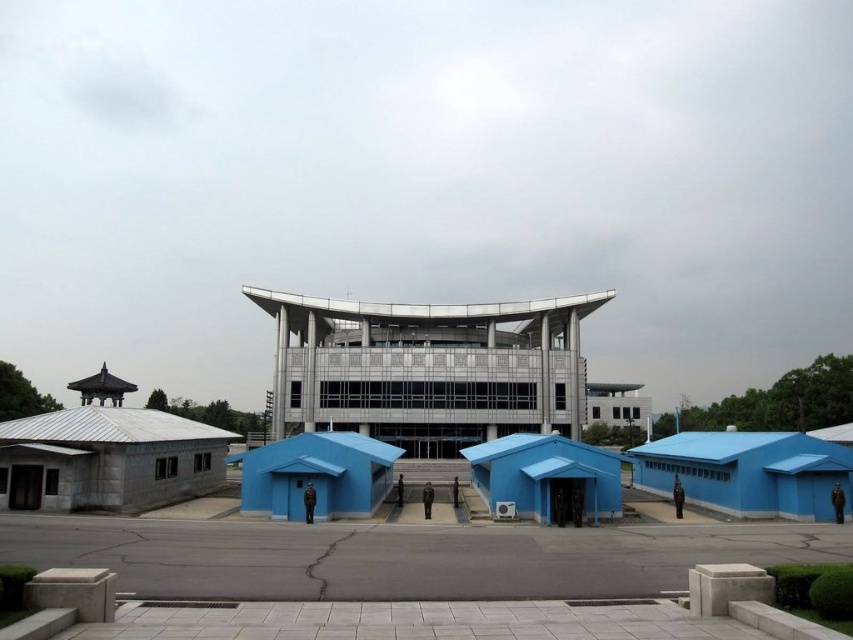
Question: Which object is the closest to the matte blue shelter at center?

Choices:
 (A) blue matte shelter at center
 (B) blue matte shelter at lower right

Answer: (A)

Question: Considering the relative positions of blue matte shelter at center and matte blue shelter at center in the image provided, where is blue matte shelter at center located with respect to matte blue shelter at center?

Choices:
 (A) above
 (B) below

Answer: (A)

Question: Which point is farther from the camera taking this photo?

Choices:
 (A) (735, 472)
 (B) (462, 451)
 (C) (370, 476)

Answer: (B)

Question: Which of the following is the closest to the observer?

Choices:
 (A) blue matte shelter at center
 (B) matte blue shelter at center

Answer: (A)

Question: Considering the relative positions of blue matte shelter at lower right and blue matte shelter at center in the image provided, where is blue matte shelter at lower right located with respect to blue matte shelter at center?

Choices:
 (A) below
 (B) above

Answer: (A)

Question: In this image, where is blue matte shelter at center located relative to matte blue shelter at center?

Choices:
 (A) left
 (B) right

Answer: (B)